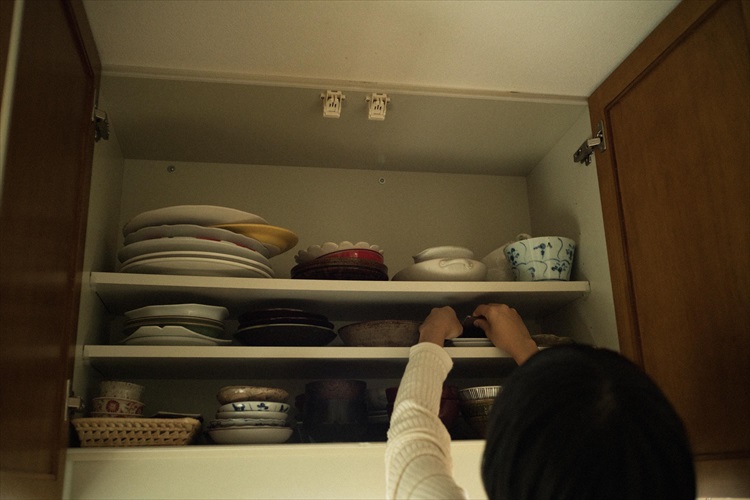
Where is `hinges`? This screenshot has width=750, height=500. hinges is located at coordinates (74, 402), (103, 123), (582, 151).